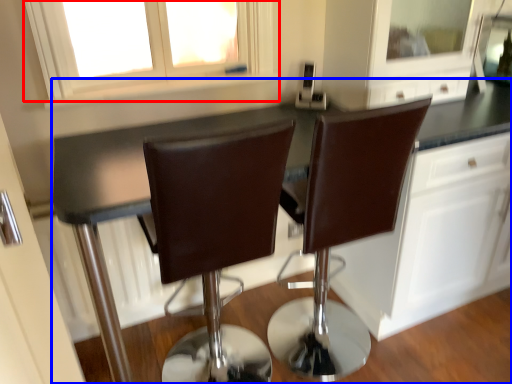
Question: Which of the following is the closest to the observer, window (highlighted by a red box) or countertop (highlighted by a blue box)?

Choices:
 (A) window
 (B) countertop

Answer: (B)